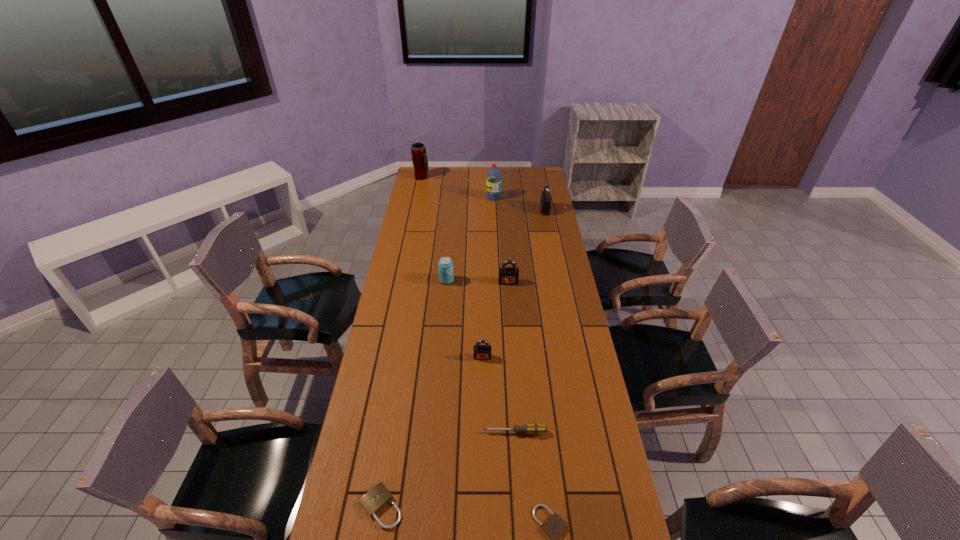
Where is `free space located on the front of the second smallest gray padlock near the keyhole`? Image resolution: width=960 pixels, height=540 pixels. free space located on the front of the second smallest gray padlock near the keyhole is located at coordinates (510, 302).

I want to click on vacant point located on the back of the beer can, so click(x=449, y=248).

Where is `vacant area situated 0.360m on the front of the sixth farthest object near the keyhole`? Image resolution: width=960 pixels, height=540 pixels. vacant area situated 0.360m on the front of the sixth farthest object near the keyhole is located at coordinates 483,457.

What are the coordinates of `free region located 0.060m at the tip of the gray screwdriver` in the screenshot? It's located at (464, 432).

Locate an element on the screen. vacant space situated 0.370m at the tip of the gray screwdriver is located at coordinates (364, 432).

Where is `free region located 0.180m at the tip of the gray screwdriver`? free region located 0.180m at the tip of the gray screwdriver is located at coordinates (425, 432).

The width and height of the screenshot is (960, 540). What are the coordinates of `free space located 0.390m on the back of the second shortest object` in the screenshot? It's located at (402, 372).

In order to click on object present at the far edge in this screenshot , I will do `click(419, 158)`.

You are a GUI agent. You are given a task and a screenshot of the screen. Output one action in this format:
    pyautogui.click(x=<x>, y=<y>)
    Task: Click on the thermos bottle that is at the left edge
    The height and width of the screenshot is (540, 960).
    Given the screenshot: What is the action you would take?
    pyautogui.click(x=419, y=158)

Where is `padlock that is at the left edge`? padlock that is at the left edge is located at coordinates (373, 501).